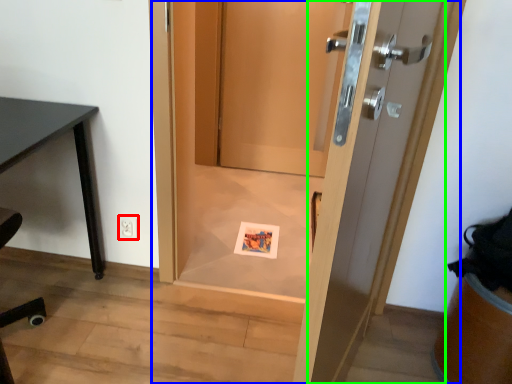
Question: Based on their relative distances, which object is farther from electric outlet (highlighted by a red box)? Choose from door (highlighted by a blue box) and door (highlighted by a green box).

Choices:
 (A) door
 (B) door

Answer: (B)